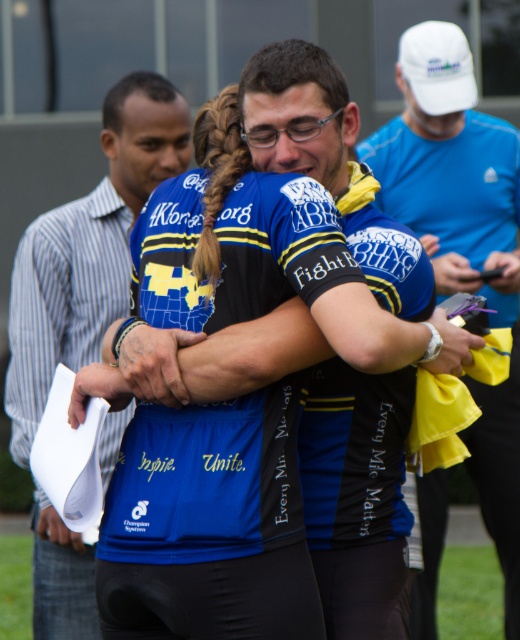
Can you confirm if matte blue jersey at center is positioned above blue jersey at left?

Yes.

Who is higher up, matte blue jersey at center or blue jersey at left?

matte blue jersey at center is above.

Between point (473, 168) and point (43, 317), which one is positioned behind?

The point (473, 168) is more distant.

The width and height of the screenshot is (520, 640). Find the location of `matte blue jersey at center`. matte blue jersey at center is located at coordinates (450, 170).

Is point (420, 634) farther from viewer compared to point (367, 522)?

Yes, point (420, 634) is farther from viewer.

How much distance is there between matte blue jersey at center and blue jersey at center?

The distance of matte blue jersey at center from blue jersey at center is 3.39 meters.

Is point (513, 628) positioned in front of point (396, 616)?

That is False.

The width and height of the screenshot is (520, 640). Find the location of `matte blue jersey at center`. matte blue jersey at center is located at coordinates (450, 170).

Consider the image. Does blue jersey at left appear on the left side of blue jersey at center?

Indeed, blue jersey at left is positioned on the left side of blue jersey at center.

Can you confirm if blue jersey at left is positioned above blue jersey at center?

Yes.

Who is more forward, (117,301) or (148,388)?

Point (148,388) is more forward.

Where is `blue jersey at left`? The image size is (520, 640). blue jersey at left is located at coordinates (88, 248).